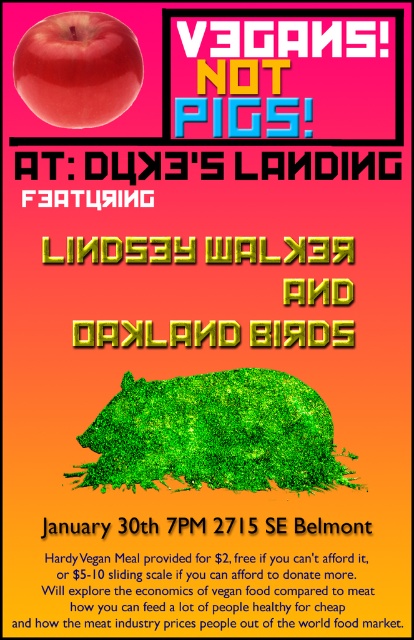
Question: Is the position of green grassy pig at center more distant than that of yellow metallic lindsey walker and oakland birds at center?

Choices:
 (A) yes
 (B) no

Answer: (B)

Question: Does green grassy pig at center come in front of shiny red apple at upper left?

Choices:
 (A) yes
 (B) no

Answer: (B)

Question: Which object is the farthest from the white paper at upper center?

Choices:
 (A) green grassy pig at center
 (B) yellow metallic lindsey walker and oakland birds at center

Answer: (B)

Question: Which point appears farthest from the camera in this image?

Choices:
 (A) (60, 564)
 (B) (96, 19)
 (C) (84, 328)

Answer: (C)

Question: Is green grassy pig at center closer to the viewer compared to shiny red apple at upper left?

Choices:
 (A) no
 (B) yes

Answer: (A)

Question: Which object is positioned farthest from the green grassy pig at center?

Choices:
 (A) yellow metallic lindsey walker and oakland birds at center
 (B) white paper at upper center

Answer: (A)